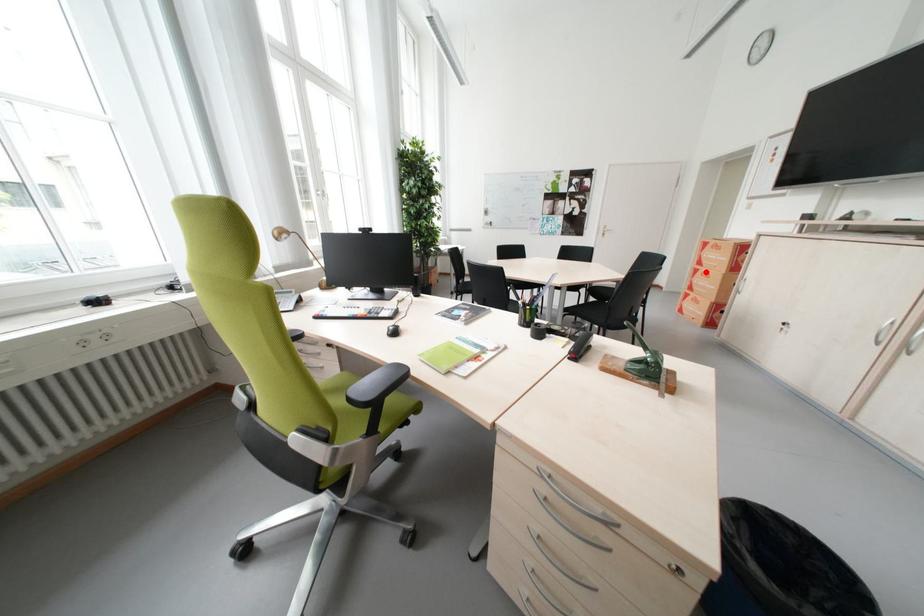
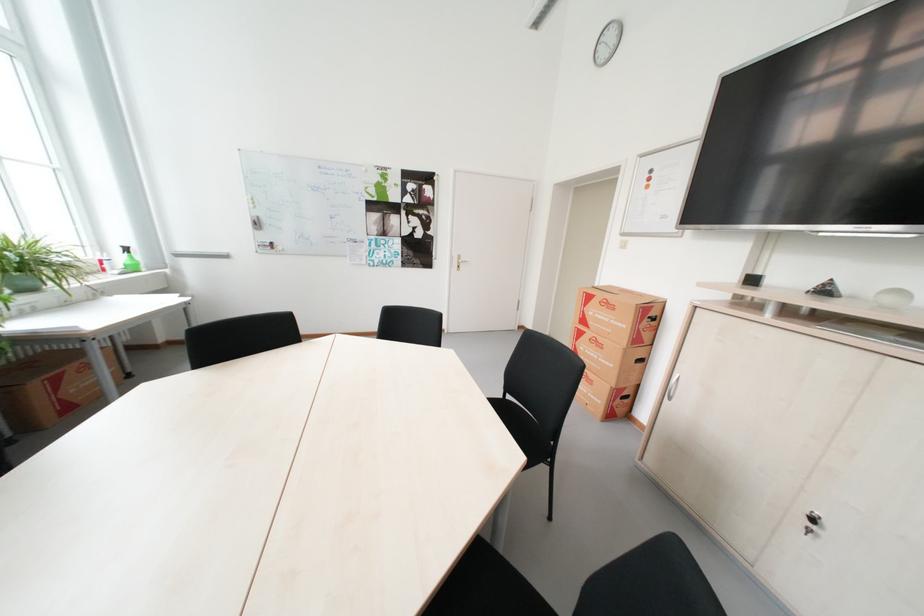
The point at the highlighted location is marked in the first image. Where is the corresponding point in the second image?

(590, 334)